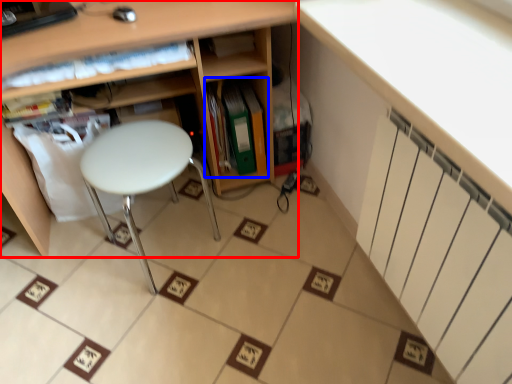
Question: Among these objects, which one is farthest to the camera, shelf (highlighted by a red box) or book (highlighted by a blue box)?

Choices:
 (A) shelf
 (B) book

Answer: (B)